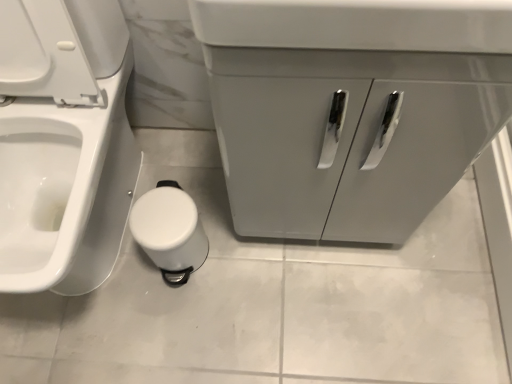
Where is `free spot to the left of white plastic toilet paper at lower center`? This screenshot has height=384, width=512. free spot to the left of white plastic toilet paper at lower center is located at coordinates (118, 270).